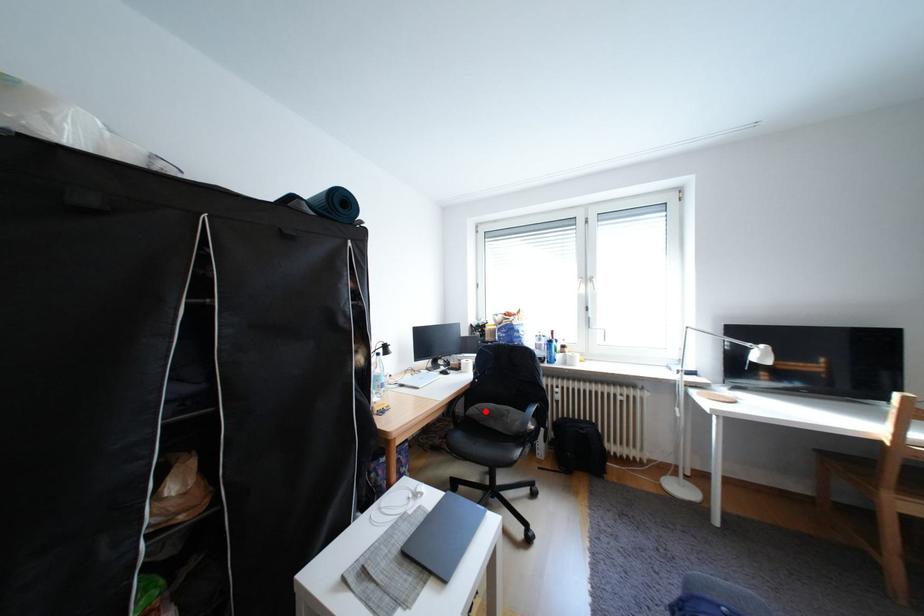
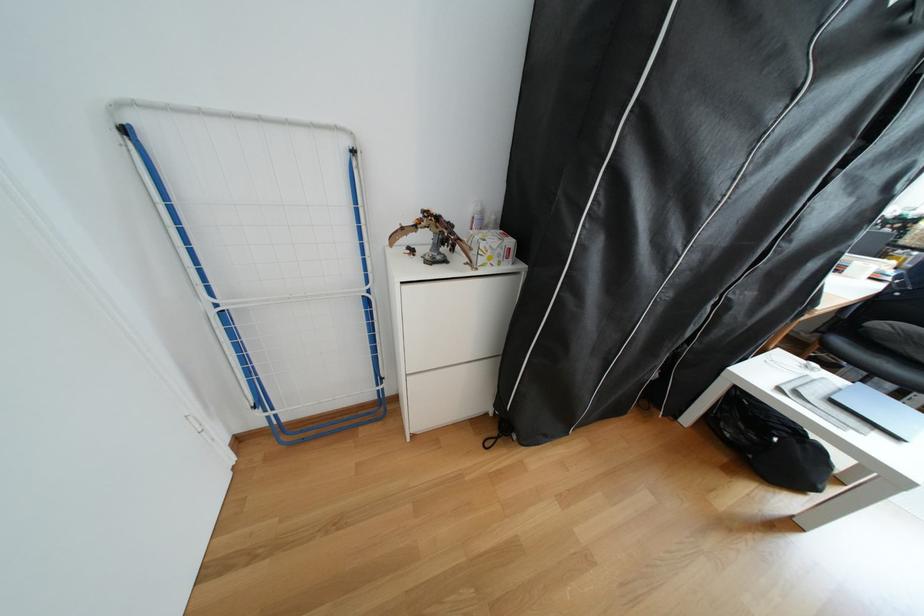
Question: A red point is marked in image1. In image2, is the corresponding 3D point closer to the camera or farther? Reply with the corresponding letter.

Choices:
 (A) The corresponding 3D point is closer.
 (B) The corresponding 3D point is farther.

Answer: (B)